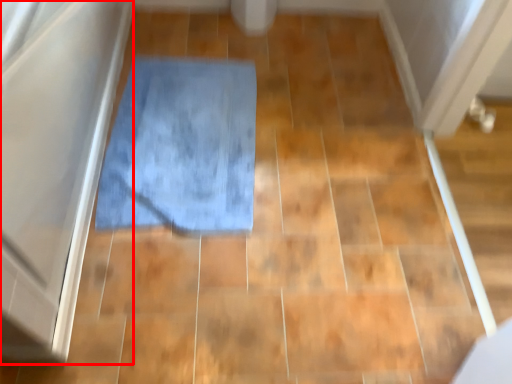
Question: From the image, what is the correct spatial relationship of screen door (annotated by the red box) in relation to bath mat?

Choices:
 (A) left
 (B) right

Answer: (A)